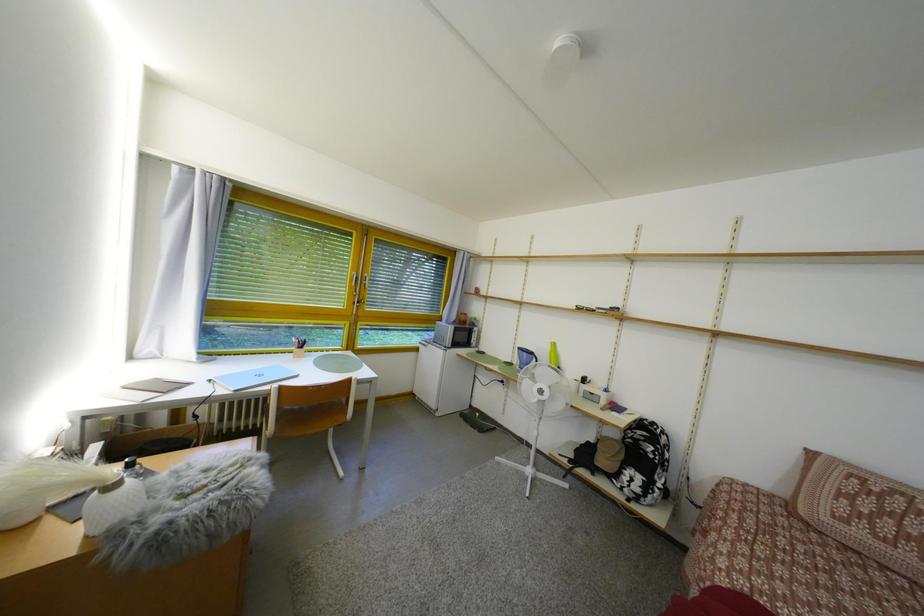
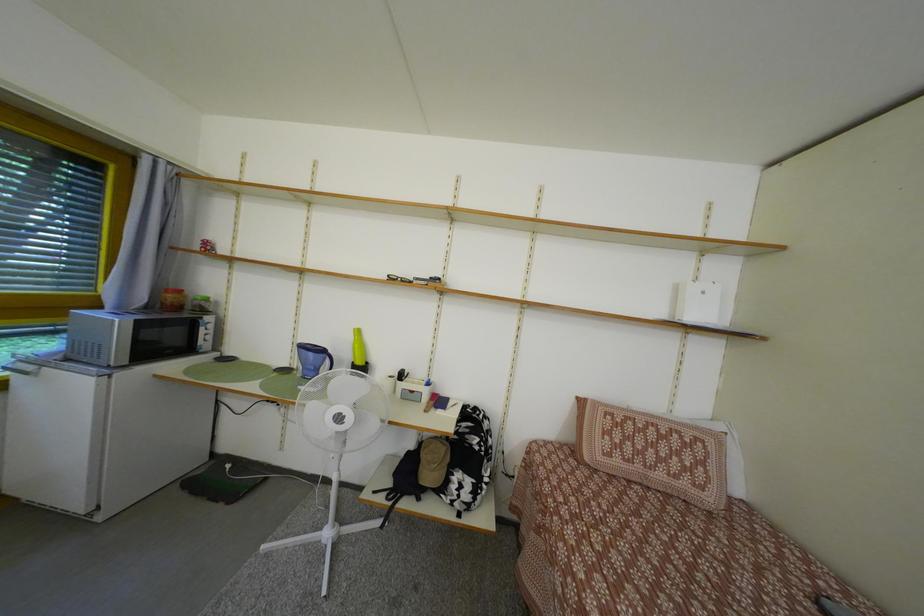
Question: Based on the continuous images, in which direction is the camera rotating? Reply with the corresponding letter.

Choices:
 (A) Left
 (B) Right
 (C) Up
 (D) Down

Answer: (B)